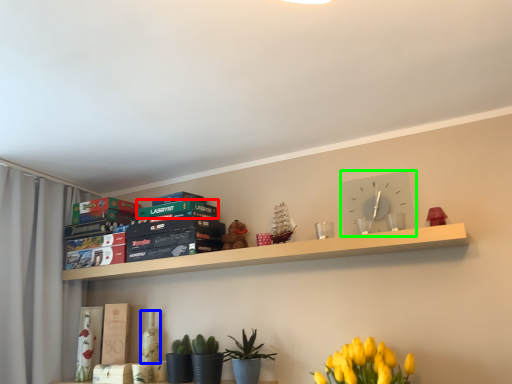
Question: Which is farther away from paperback book (highlighted by a red box)? bottle (highlighted by a blue box) or clock (highlighted by a green box)?

Choices:
 (A) bottle
 (B) clock

Answer: (B)